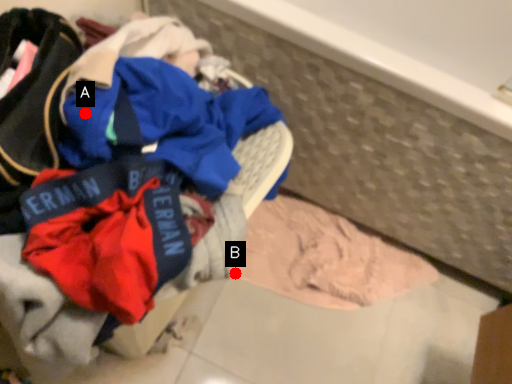
Question: Two points are circled on the image, labeled by A and B beside each circle. Among these points, which one is farthest from the camera?

Choices:
 (A) A is further
 (B) B is further

Answer: (B)